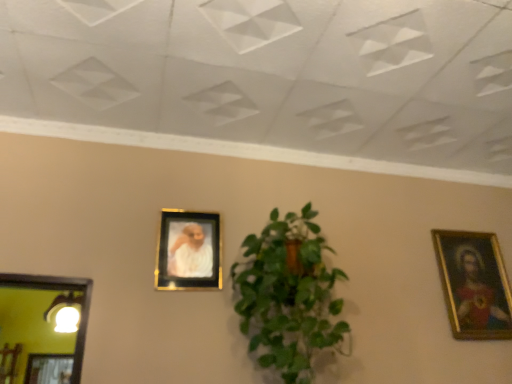
Identify the location of gold-framed painting at right, the second picture frame from the left. [474, 284].

The width and height of the screenshot is (512, 384). Describe the element at coordinates (288, 295) in the screenshot. I see `green leafy plant at center` at that location.

In order to face gold metallic picture frame at center, placed as the 1th picture frame when sorted from left to right, should I rotate leftwards or rightwards?

You should rotate left by 8.615 degrees.

Image resolution: width=512 pixels, height=384 pixels. What are the coordinates of `gold-framed painting at right, the second picture frame from the left` in the screenshot? It's located at (474, 284).

From a real-world perspective, relative to gold metallic picture frame at center, the 2th picture frame when ordered from right to left, is green leafy plant at center vertically above or below?

In terms of real-world spatial position, green leafy plant at center is below gold metallic picture frame at center, the 2th picture frame when ordered from right to left.

From the image's perspective, is green leafy plant at center located above or below gold metallic picture frame at center, the first picture frame viewed from the front?

Based on their image positions, green leafy plant at center is located beneath gold metallic picture frame at center, the first picture frame viewed from the front.

Is point (240, 325) farther from camera compared to point (186, 216)?

No, it is not.

Considering the positions of objects gold-framed painting at right, the 1th picture frame from the right, and gold metallic picture frame at center, placed as the 1th picture frame when sorted from left to right, in the image provided, who is behind, gold-framed painting at right, the 1th picture frame from the right, or gold metallic picture frame at center, placed as the 1th picture frame when sorted from left to right,?

gold-framed painting at right, the 1th picture frame from the right, is further from the camera.

Looking at this image, how different are the orientations of gold-framed painting at right, the 1th picture frame from the right, and gold metallic picture frame at center, the 2th picture frame when ordered from right to left, in degrees?

The facing directions of gold-framed painting at right, the 1th picture frame from the right, and gold metallic picture frame at center, the 2th picture frame when ordered from right to left, are 0.0283 degrees apart.

Is gold-framed painting at right, the 1th picture frame from the right, completely or partially outside of gold metallic picture frame at center, which is counted as the second picture frame, starting from the back?

Yes.

What's the angular difference between gold metallic picture frame at center, the 2th picture frame when ordered from right to left, and green leafy plant at center's facing directions?

The angular difference between gold metallic picture frame at center, the 2th picture frame when ordered from right to left, and green leafy plant at center is 0.267 degrees.

Who is bigger, gold metallic picture frame at center, which is counted as the second picture frame, starting from the back, or green leafy plant at center?

With larger size is green leafy plant at center.

Could you measure the distance between gold metallic picture frame at center, placed as the 1th picture frame when sorted from left to right, and green leafy plant at center?

The distance of gold metallic picture frame at center, placed as the 1th picture frame when sorted from left to right, from green leafy plant at center is 12.59 inches.

Is gold metallic picture frame at center, which is counted as the second picture frame, starting from the back, spatially inside green leafy plant at center, or outside of it?

gold metallic picture frame at center, which is counted as the second picture frame, starting from the back, is not inside green leafy plant at center, it's outside.

How many degrees apart are the facing directions of green leafy plant at center and gold-framed painting at right, the second picture frame from the left?

0.295 degrees separate the facing orientations of green leafy plant at center and gold-framed painting at right, the second picture frame from the left.

Is green leafy plant at center smaller than gold-framed painting at right, which appears as the 1th picture frame when viewed from the back?

No, green leafy plant at center is not smaller than gold-framed painting at right, which appears as the 1th picture frame when viewed from the back.

From the image's perspective, between green leafy plant at center and gold-framed painting at right, the second picture frame from the left, who is located below?

From the image's view, gold-framed painting at right, the second picture frame from the left, is below.

From a real-world perspective, is green leafy plant at center physically located above or below gold-framed painting at right, which is counted as the second picture frame, starting from the front?

Clearly, from a real-world perspective, green leafy plant at center is below gold-framed painting at right, which is counted as the second picture frame, starting from the front.

Which is in front, gold metallic picture frame at center, placed as the 1th picture frame when sorted from left to right, or gold-framed painting at right, which appears as the 1th picture frame when viewed from the back?

gold metallic picture frame at center, placed as the 1th picture frame when sorted from left to right, is in front.

Is gold metallic picture frame at center, which is counted as the second picture frame, starting from the back, oriented towards gold-framed painting at right, the second picture frame from the left?

No, gold metallic picture frame at center, which is counted as the second picture frame, starting from the back, is not turned towards gold-framed painting at right, the second picture frame from the left.

Looking at their sizes, would you say gold metallic picture frame at center, the first picture frame viewed from the front, is wider or thinner than gold-framed painting at right, which is counted as the second picture frame, starting from the front?

In the image, gold metallic picture frame at center, the first picture frame viewed from the front, appears to be wider than gold-framed painting at right, which is counted as the second picture frame, starting from the front.

How different are the orientations of gold metallic picture frame at center, the 2th picture frame when ordered from right to left, and gold-framed painting at right, which appears as the 1th picture frame when viewed from the back, in degrees?

The angle between the facing direction of gold metallic picture frame at center, the 2th picture frame when ordered from right to left, and the facing direction of gold-framed painting at right, which appears as the 1th picture frame when viewed from the back, is 0.0283 degrees.

From the picture: Can you tell me how much gold-framed painting at right, which appears as the 1th picture frame when viewed from the back, and green leafy plant at center differ in facing direction?

gold-framed painting at right, which appears as the 1th picture frame when viewed from the back, and green leafy plant at center are facing 0.295 degrees away from each other.

Does gold-framed painting at right, which appears as the 1th picture frame when viewed from the back, appear on the left side of green leafy plant at center?

Incorrect, gold-framed painting at right, which appears as the 1th picture frame when viewed from the back, is not on the left side of green leafy plant at center.

Which picture frame is the 2nd one when counting from the back of the green leafy plant at center? Please provide its 2D coordinates.

[(474, 284)]

Considering their positions, is gold-framed painting at right, the 1th picture frame from the right, located in front of or behind green leafy plant at center?

Clearly, gold-framed painting at right, the 1th picture frame from the right, is behind green leafy plant at center.

Locate an element on the screen. Image resolution: width=512 pixels, height=384 pixels. houseplant below the gold metallic picture frame at center, the 2th picture frame when ordered from right to left (from the image's perspective) is located at coordinates (288, 295).

Locate an element on the screen. The height and width of the screenshot is (384, 512). picture frame behind the gold metallic picture frame at center, which is counted as the second picture frame, starting from the back is located at coordinates (474, 284).

Which object lies further to the anchor point gold metallic picture frame at center, the 2th picture frame when ordered from right to left, green leafy plant at center or gold-framed painting at right, which is counted as the second picture frame, starting from the front?

The object further to gold metallic picture frame at center, the 2th picture frame when ordered from right to left, is gold-framed painting at right, which is counted as the second picture frame, starting from the front.

Looking at this image, considering their positions, is gold metallic picture frame at center, which is counted as the second picture frame, starting from the back, positioned further to green leafy plant at center than gold-framed painting at right, the 1th picture frame from the right?

gold-framed painting at right, the 1th picture frame from the right, is further to green leafy plant at center.

Considering their positions, is green leafy plant at center positioned further to gold-framed painting at right, the second picture frame from the left, than gold metallic picture frame at center, which is counted as the second picture frame, starting from the back?

Based on the image, gold metallic picture frame at center, which is counted as the second picture frame, starting from the back, appears to be further to gold-framed painting at right, the second picture frame from the left.

When comparing their distances from gold-framed painting at right, which appears as the 1th picture frame when viewed from the back, does gold metallic picture frame at center, the 2th picture frame when ordered from right to left, or green leafy plant at center seem closer?

green leafy plant at center is closer to gold-framed painting at right, which appears as the 1th picture frame when viewed from the back.

Looking at the image, which one is located further to gold metallic picture frame at center, which is counted as the second picture frame, starting from the back, gold-framed painting at right, the second picture frame from the left, or green leafy plant at center?

The object further to gold metallic picture frame at center, which is counted as the second picture frame, starting from the back, is gold-framed painting at right, the second picture frame from the left.

Which object lies further to the anchor point green leafy plant at center, gold-framed painting at right, the 1th picture frame from the right, or gold metallic picture frame at center, the first picture frame viewed from the front?

Based on the image, gold-framed painting at right, the 1th picture frame from the right, appears to be further to green leafy plant at center.

Locate an element on the screen. houseplant between gold metallic picture frame at center, placed as the 1th picture frame when sorted from left to right, and gold-framed painting at right, the second picture frame from the left, in the horizontal direction is located at coordinates (288, 295).